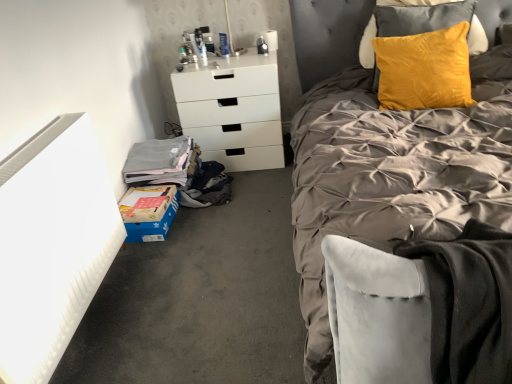
The image size is (512, 384). In order to click on space that is in front of white matte chest of drawers at center in this screenshot , I will do `click(248, 193)`.